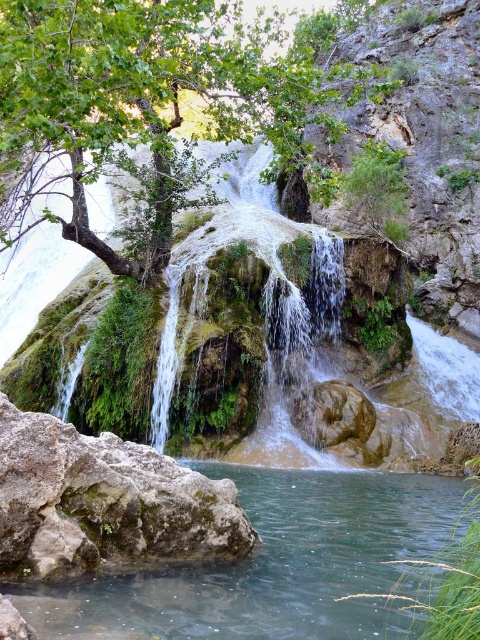
Question: Which of these objects is positioned closest to the rusty brown rock at lower left?

Choices:
 (A) brown rough rock at center
 (B) white frothy water at center
 (C) green leafy tree at upper center

Answer: (A)

Question: Among these objects, which one is farthest from the camera?

Choices:
 (A) white frothy water at center
 (B) clear water at rock left
 (C) rusty brown rock at lower left
 (D) green leafy tree at upper center

Answer: (A)

Question: Which object is positioned farthest from the green leafy tree at upper center?

Choices:
 (A) brown rough rock at center
 (B) clear water at rock left
 (C) rusty brown rock at lower left
 (D) white frothy water at center

Answer: (B)

Question: Does white frothy water at center appear on the right side of brown rough rock at center?

Choices:
 (A) no
 (B) yes

Answer: (A)

Question: In this image, where is rusty brown rock at lower left located relative to white frothy water at center?

Choices:
 (A) above
 (B) below

Answer: (B)

Question: Does green leafy tree at upper center appear on the right side of clear water at rock left?

Choices:
 (A) yes
 (B) no

Answer: (B)